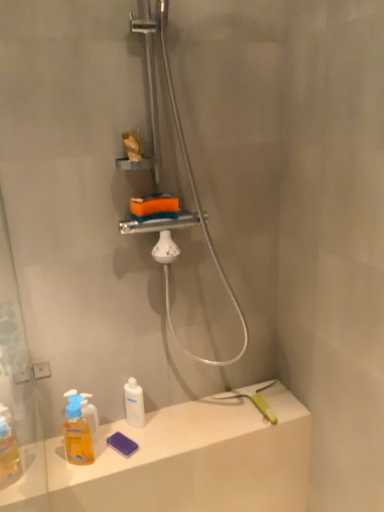
The width and height of the screenshot is (384, 512). I want to click on spots to the right of translucent plastic mouthwash at lower left, which is the second mouthwash from right to left, so click(129, 452).